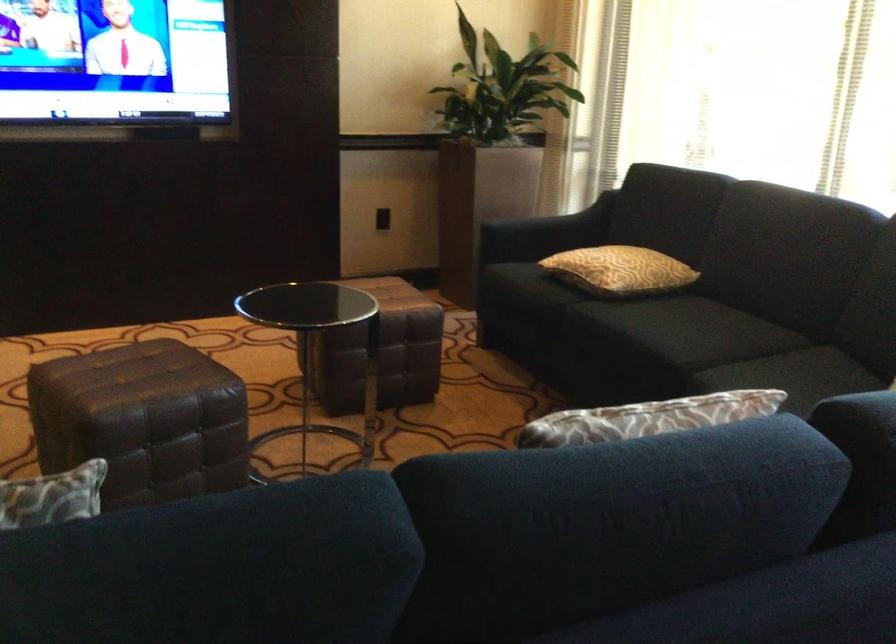
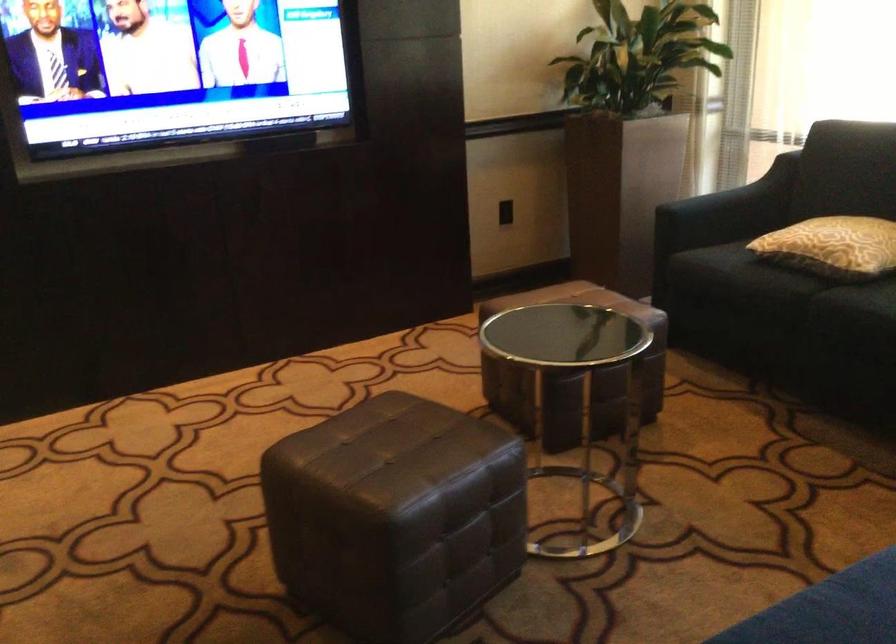
Find the pixel in the second image that matches (558,223) in the first image.

(742, 196)